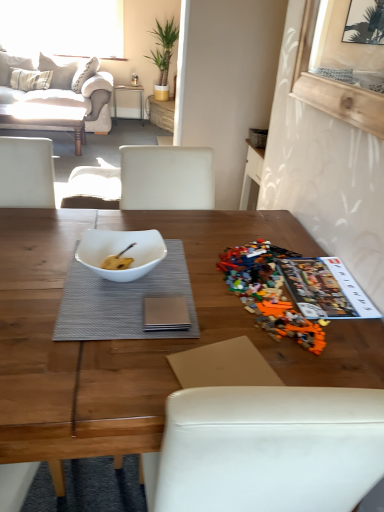
Question: In terms of height, does transparent glass window at upper center look taller or shorter compared to matte white coffee table at upper left, which is the second coffee table from right to left?

Choices:
 (A) short
 (B) tall

Answer: (B)

Question: Considering the positions of transparent glass window at upper center and matte white coffee table at upper left, the 2th coffee table positioned from the front, in the image, is transparent glass window at upper center bigger or smaller than matte white coffee table at upper left, the 2th coffee table positioned from the front,?

Choices:
 (A) big
 (B) small

Answer: (B)

Question: Considering the real-world distances, which object is farthest from the white paper magazine at right?

Choices:
 (A) plaid fabric pillow at upper left, the 1th pillow viewed from the left
 (B) beige fabric couch at upper left
 (C) metallic silver table at center
 (D) transparent glass window at upper center
 (E) multicolored plastic lego set at right

Answer: (D)

Question: Estimate the real-world distances between objects in this image. Which object is closer to the white glossy bowl at center?

Choices:
 (A) transparent glass window at upper center
 (B) matte white coffee table at upper left, which is the second coffee table from right to left
 (C) metallic silver table at center
 (D) plaid fabric pillow at upper left, the 1th pillow viewed from the left
 (E) gray textured placemat at center

Answer: (E)